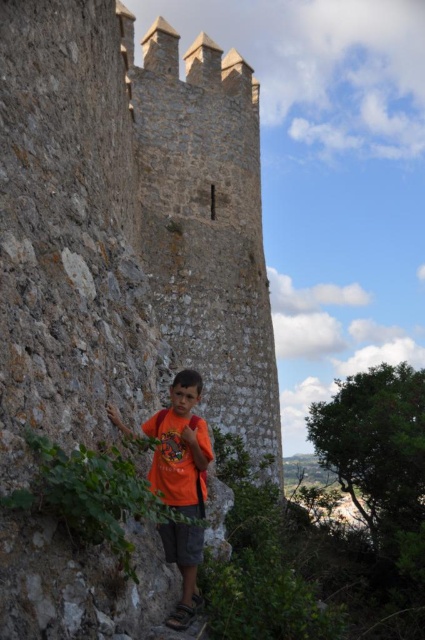
Can you confirm if rustic stone tower at center is positioned to the right of orange cotton shirt at center?

Indeed, rustic stone tower at center is positioned on the right side of orange cotton shirt at center.

Does rustic stone tower at center have a smaller size compared to orange cotton shirt at center?

No.

Locate an element on the screen. This screenshot has height=640, width=425. rustic stone tower at center is located at coordinates (127, 228).